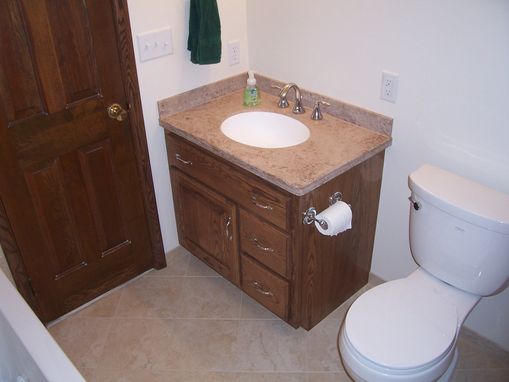
At what (x,y) coordinates should I click in order to perform the action: click on sink basin. Please return your answer as a coordinate pair (x, y). Looking at the image, I should click on (262, 133).